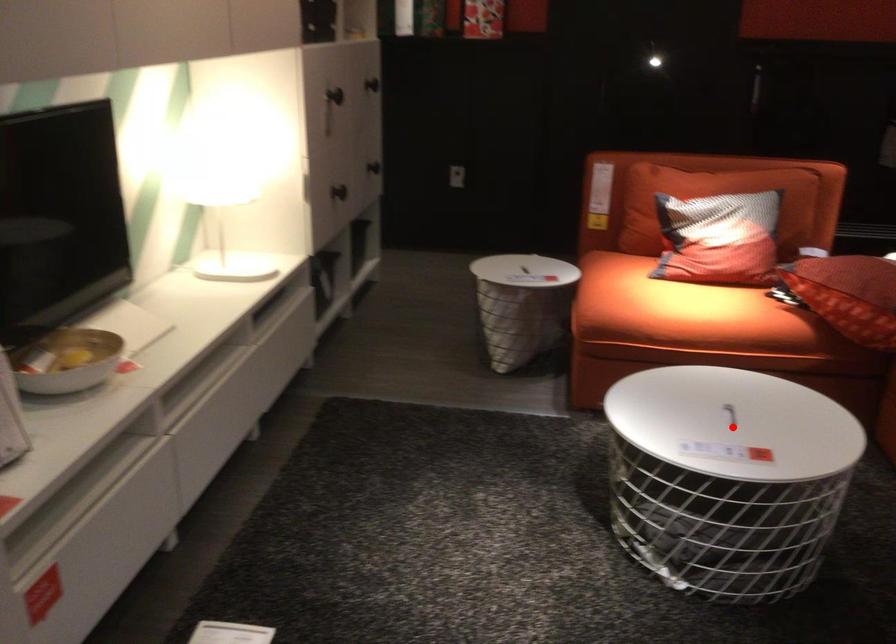
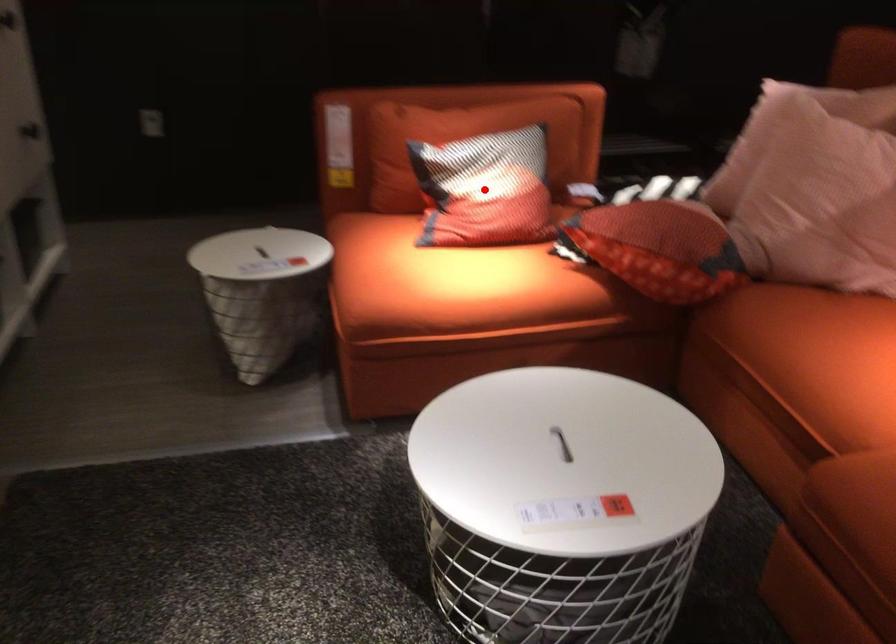
I am providing you with two images of the same scene from different viewpoints. A red point is marked on the first image and another point is marked on the second image. Are the points marked in image1 and image2 representing the same 3D position?

No